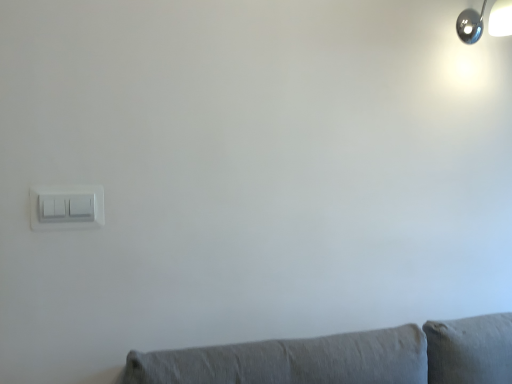
Question: Should I look upward or downward to see white plastic light switch at left?

Choices:
 (A) up
 (B) down

Answer: (B)

Question: Is white plastic light switch at left thinner than polished chrome lamp at upper right?

Choices:
 (A) yes
 (B) no

Answer: (A)

Question: Does white plastic light switch at left have a greater height compared to polished chrome lamp at upper right?

Choices:
 (A) yes
 (B) no

Answer: (B)

Question: Is white plastic light switch at left at the left side of polished chrome lamp at upper right?

Choices:
 (A) no
 (B) yes

Answer: (B)

Question: Can you confirm if white plastic light switch at left is positioned to the right of polished chrome lamp at upper right?

Choices:
 (A) yes
 (B) no

Answer: (B)

Question: Is white plastic light switch at left shorter than polished chrome lamp at upper right?

Choices:
 (A) yes
 (B) no

Answer: (A)

Question: Are white plastic light switch at left and polished chrome lamp at upper right located far from each other?

Choices:
 (A) yes
 (B) no

Answer: (A)

Question: Does polished chrome lamp at upper right have a larger size compared to white plastic light switch at left?

Choices:
 (A) no
 (B) yes

Answer: (B)

Question: Is white plastic light switch at left located within polished chrome lamp at upper right?

Choices:
 (A) no
 (B) yes

Answer: (A)

Question: Is polished chrome lamp at upper right completely or partially outside of white plastic light switch at left?

Choices:
 (A) yes
 (B) no

Answer: (A)

Question: Is polished chrome lamp at upper right at the left side of white plastic light switch at left?

Choices:
 (A) no
 (B) yes

Answer: (A)

Question: Considering the relative sizes of polished chrome lamp at upper right and white plastic light switch at left in the image provided, is polished chrome lamp at upper right shorter than white plastic light switch at left?

Choices:
 (A) yes
 (B) no

Answer: (B)

Question: Is polished chrome lamp at upper right oriented towards white plastic light switch at left?

Choices:
 (A) yes
 (B) no

Answer: (B)

Question: Is white plastic light switch at left to the left or to the right of polished chrome lamp at upper right in the image?

Choices:
 (A) right
 (B) left

Answer: (B)